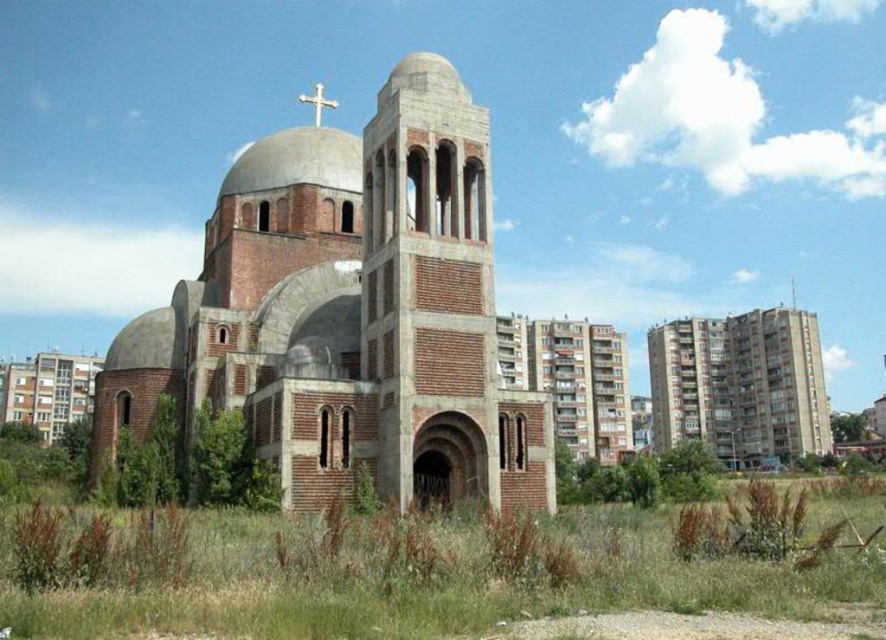
You are an architect evaluating the site for potential expansion. You notice the red brick chapel at center and the concrete building at right. Which structure would require more space if you were to add an extension to it?

The concrete building at right requires more space for an extension since it is larger than the red brick chapel at center.

Looking at this image, you are a city planner reviewing this area. You notice the red brick chapel at center and the concrete building at right. Which structure is positioned closer to the left side of the scene?

The red brick chapel at center is to the left of the concrete building at right, so it is positioned closer to the left side of the scene.